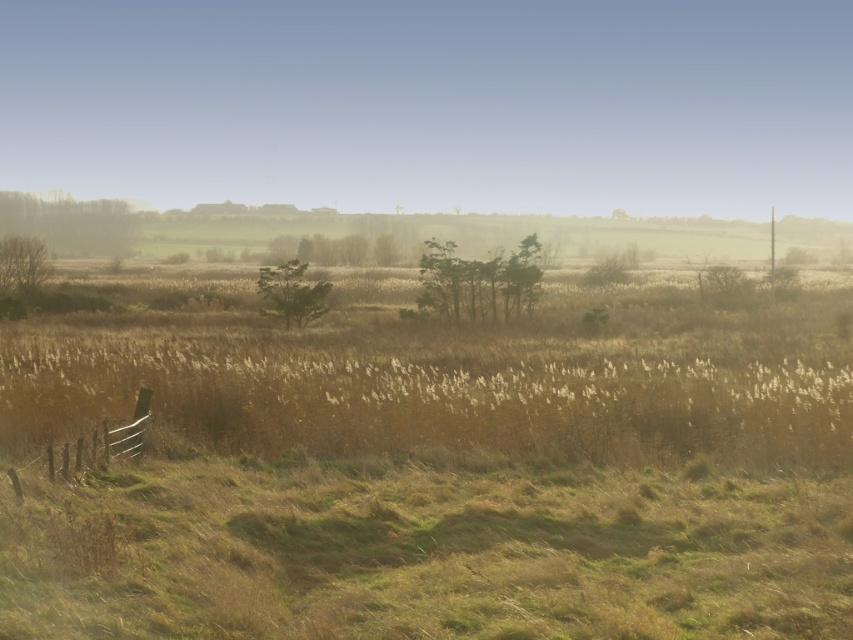
You are standing in the rural landscape and want to place a small decorative garden statue exactly at the point marked as point (479, 282). Based on the scene description, where would this point be located relative to the green matte trees at center?

The point (479, 282) is on the green matte trees at center, so placing the statue there would position it directly among the trees.

You are an environmental scientist analyzing this landscape. You notice the green matte tree at center and the bare branches at left. Based on their positions, which one is closer to the ground?

The green matte tree at center is closer to the ground because it is positioned below the bare branches at left.